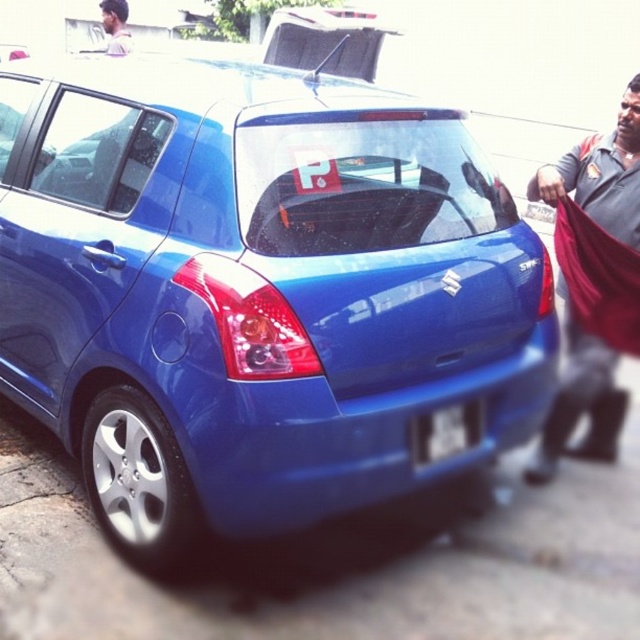
Question: Can you confirm if glossy blue hatchback at center is bigger than blue fabric at right?

Choices:
 (A) no
 (B) yes

Answer: (B)

Question: Which object appears closest to the camera in this image?

Choices:
 (A) blue fabric at right
 (B) glossy blue hatchback at center
 (C) white plastic license plate at center
 (D) smooth skin face at upper left

Answer: (B)

Question: Estimate the real-world distances between objects in this image. Which object is farther from the white plastic license plate at center?

Choices:
 (A) smooth skin face at upper left
 (B) glossy blue hatchback at center
 (C) blue fabric at right

Answer: (A)

Question: Is white plastic license plate at center behind smooth skin face at upper left?

Choices:
 (A) yes
 (B) no

Answer: (B)

Question: Which object is closer to the camera taking this photo?

Choices:
 (A) blue fabric at right
 (B) white plastic license plate at center
 (C) smooth skin face at upper left

Answer: (B)

Question: Does white plastic license plate at center appear under smooth skin face at upper left?

Choices:
 (A) no
 (B) yes

Answer: (B)